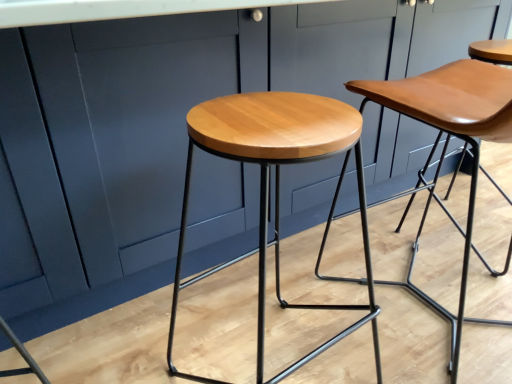
Question: Do you think shiny wood stool at center, the 1th stool in the left-to-right sequence, is within matte wood stool at center, which ranks as the first stool in right-to-left order, or outside of it?

Choices:
 (A) outside
 (B) inside

Answer: (A)

Question: Does point (271, 155) appear closer or farther from the camera than point (364, 87)?

Choices:
 (A) closer
 (B) farther

Answer: (A)

Question: From the image's perspective, is shiny wood stool at center, the 1th stool in the left-to-right sequence, located above or below matte wood stool at center, which ranks as the first stool in right-to-left order?

Choices:
 (A) above
 (B) below

Answer: (B)

Question: From their relative heights in the image, would you say matte wood stool at center, positioned as the 2th stool in left-to-right order, is taller or shorter than shiny wood stool at center, which is counted as the second stool, starting from the right?

Choices:
 (A) tall
 (B) short

Answer: (A)

Question: In terms of size, does matte wood stool at center, which ranks as the first stool in right-to-left order, appear bigger or smaller than shiny wood stool at center, which is counted as the second stool, starting from the right?

Choices:
 (A) small
 (B) big

Answer: (B)

Question: Is matte wood stool at center, which ranks as the first stool in right-to-left order, to the left or to the right of shiny wood stool at center, the 1th stool in the left-to-right sequence, in the image?

Choices:
 (A) left
 (B) right

Answer: (B)

Question: Choose the correct answer: Is matte wood stool at center, which ranks as the first stool in right-to-left order, inside shiny wood stool at center, the 1th stool in the left-to-right sequence, or outside it?

Choices:
 (A) inside
 (B) outside

Answer: (B)